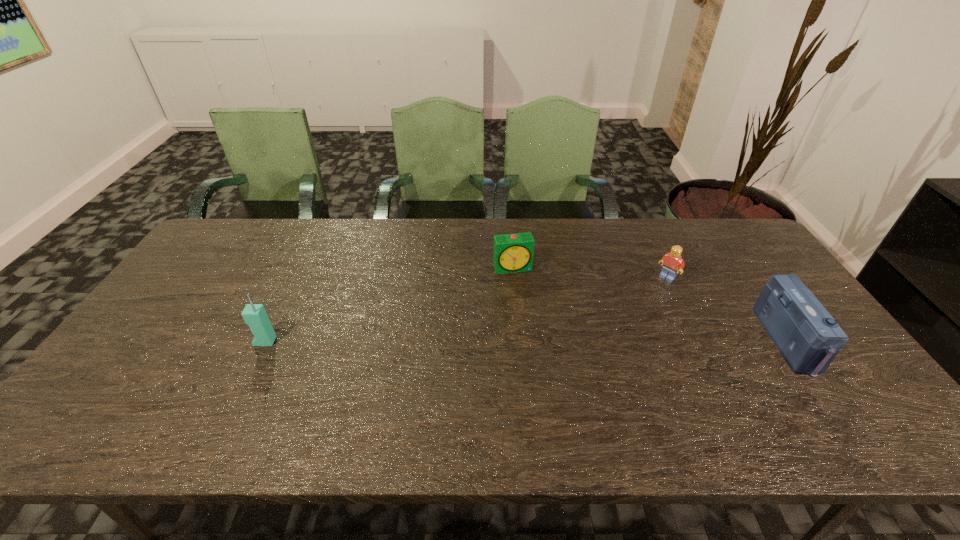
Locate an element on the screen. The width and height of the screenshot is (960, 540). cellular telephone is located at coordinates (254, 315).

Identify the location of the leftmost object. The height and width of the screenshot is (540, 960). (254, 315).

Identify the location of the rightmost object. Image resolution: width=960 pixels, height=540 pixels. (807, 336).

Where is `the third object from right to left`? Image resolution: width=960 pixels, height=540 pixels. the third object from right to left is located at coordinates (512, 253).

Locate an element on the screen. This screenshot has width=960, height=540. Lego is located at coordinates (672, 261).

The width and height of the screenshot is (960, 540). What are the coordinates of `vacant space located 0.260m on the keypad of the tallest object` in the screenshot? It's located at (157, 341).

Locate an element on the screen. Image resolution: width=960 pixels, height=540 pixels. vacant region located 0.330m on the keypad of the tallest object is located at coordinates (131, 341).

What are the coordinates of `free spot located on the keypad of the tallest object` in the screenshot? It's located at (164, 341).

Where is `free space located 0.050m on the lens of the camera`? This screenshot has width=960, height=540. free space located 0.050m on the lens of the camera is located at coordinates (825, 341).

In order to click on vacant space located on the front-facing side of the second object from left to right in this screenshot , I will do `click(536, 332)`.